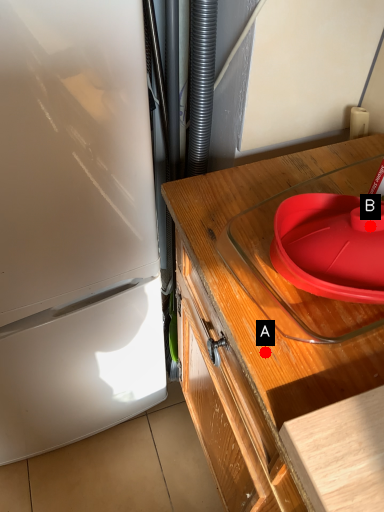
Question: Two points are circled on the image, labeled by A and B beside each circle. Which point is farther to the camera?

Choices:
 (A) A is further
 (B) B is further

Answer: (A)